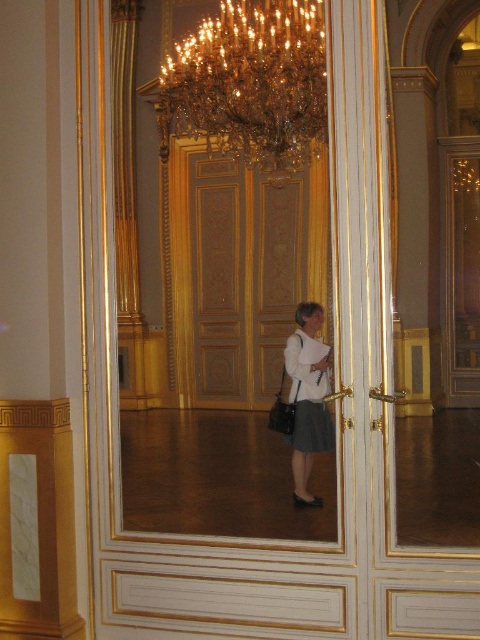
Looking at this image, does wooden paneling at center appear under white fabric blouse at center?

Incorrect, wooden paneling at center is not positioned below white fabric blouse at center.

Who is positioned more to the right, wooden paneling at center or white fabric blouse at center?

From the viewer's perspective, white fabric blouse at center appears more on the right side.

You are a GUI agent. You are given a task and a screenshot of the screen. Output one action in this format:
    pyautogui.click(x=<x>, y=<y>)
    Task: Click on the wooden paneling at center
    
    Given the screenshot: What is the action you would take?
    pyautogui.click(x=239, y=273)

You are a GUI agent. You are given a task and a screenshot of the screen. Output one action in this format:
    pyautogui.click(x=<x>, y=<y>)
    Task: Click on the wooden paneling at center
    This screenshot has height=640, width=480.
    Given the screenshot: What is the action you would take?
    pyautogui.click(x=239, y=273)

Measure the distance between wooden paneling at center and gold crystal chandelier at upper center.

wooden paneling at center is 4.24 feet from gold crystal chandelier at upper center.

Is wooden paneling at center below gold crystal chandelier at upper center?

Yes, wooden paneling at center is below gold crystal chandelier at upper center.

Is point (206, 275) closer to viewer compared to point (314, 19)?

No.

At what (x,y) coordinates should I click in order to perform the action: click on wooden paneling at center. Please return your answer as a coordinate pair (x, y). This screenshot has width=480, height=640. Looking at the image, I should click on (239, 273).

Based on the photo, does gold crystal chandelier at upper center appear on the left side of white fabric blouse at center?

Yes, gold crystal chandelier at upper center is to the left of white fabric blouse at center.

Is point (230, 54) positioned behind point (294, 435)?

That is True.

Which is behind, point (302, 124) or point (299, 324)?

Point (302, 124)

Locate an element on the screen. gold crystal chandelier at upper center is located at coordinates (251, 83).